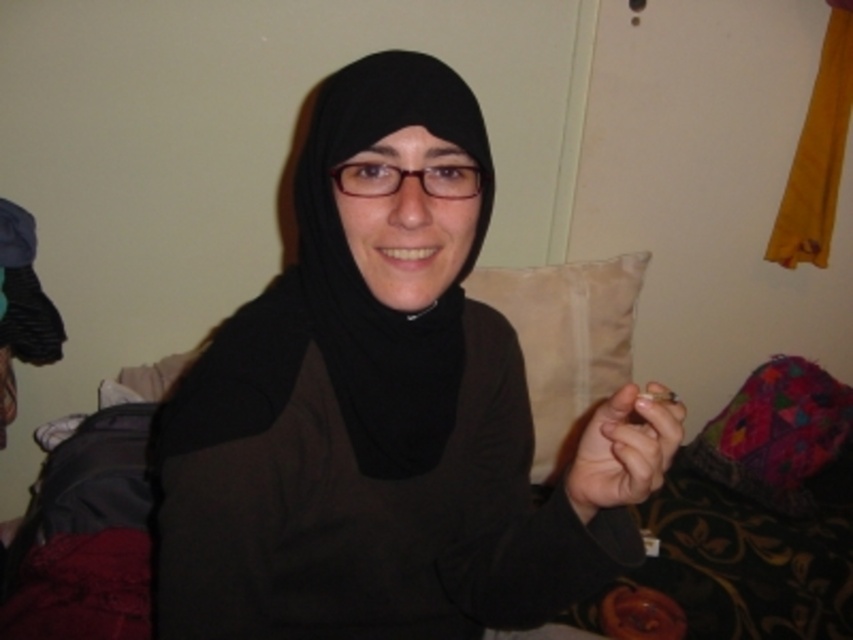
Does black matte scarf at center appear over smooth skin at center?

Correct, black matte scarf at center is located above smooth skin at center.

Is point (219, 417) positioned after point (585, 506)?

Yes, point (219, 417) is farther from viewer.

The width and height of the screenshot is (853, 640). Describe the element at coordinates (344, 294) in the screenshot. I see `black matte scarf at center` at that location.

Where is `black matte scarf at center`? This screenshot has height=640, width=853. black matte scarf at center is located at coordinates pyautogui.click(x=344, y=294).

Based on the photo, who is taller, black matte hijab at center or smooth skin at center?

Standing taller between the two is black matte hijab at center.

Between point (428, 532) and point (635, 472), which one is positioned in front?

Point (635, 472) is more forward.

Does point (329, 180) come behind point (589, 484)?

Yes, it is behind point (589, 484).

You are a GUI agent. You are given a task and a screenshot of the screen. Output one action in this format:
    pyautogui.click(x=<x>, y=<y>)
    Task: Click on the black matte hijab at center
    The image size is (853, 640).
    Given the screenshot: What is the action you would take?
    pyautogui.click(x=370, y=406)

In the scene shown: Who is lower down, black matte hijab at center or black matte scarf at center?

black matte hijab at center is lower down.

Is black matte hijab at center to the right of black matte scarf at center from the viewer's perspective?

Yes, black matte hijab at center is to the right of black matte scarf at center.

Is point (430, 204) less distant than point (376, 342)?

Yes, point (430, 204) is in front of point (376, 342).

Find the location of a particular element. The width and height of the screenshot is (853, 640). black matte hijab at center is located at coordinates (370, 406).